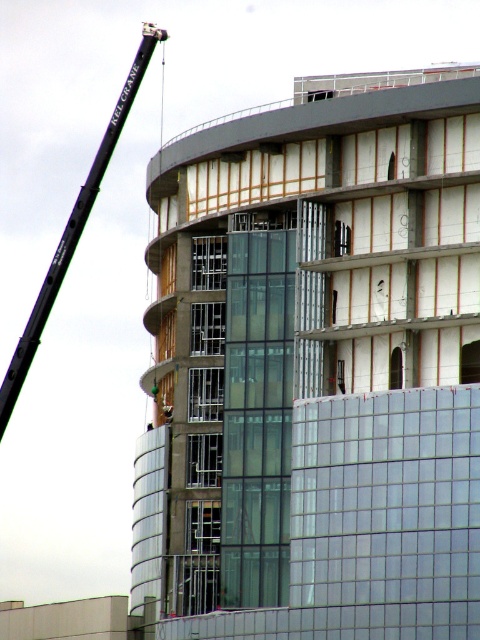
You are an engineer inspecting the construction site. You need to ensure that the clear glass building at center is not obstructed by the black metal crane at upper left during its operation. Based on their positions, is there a risk of the crane interfering with the building?

The clear glass building at center is positioned under the black metal crane at upper left, so there is a risk of the crane interfering with the building during its operation.

You are an architect reviewing the construction site. You notice the clear glass building at center and the black metal crane at upper left. Which structure is taller?

The clear glass building at center has a lesser height compared to black metal crane at upper left, so the black metal crane at upper left is taller.

You are a construction worker standing at the base of the KEL CRANE on the upper left. You need to determine the visibility of two points marked on your blueprint. The first point is at coordinate point (212,611), and the second is at point (137,83). Which point is more visible to you from your current position?

Point (212,611) is closer to the viewer than point (137,83), so the first point is more visible from your current position.